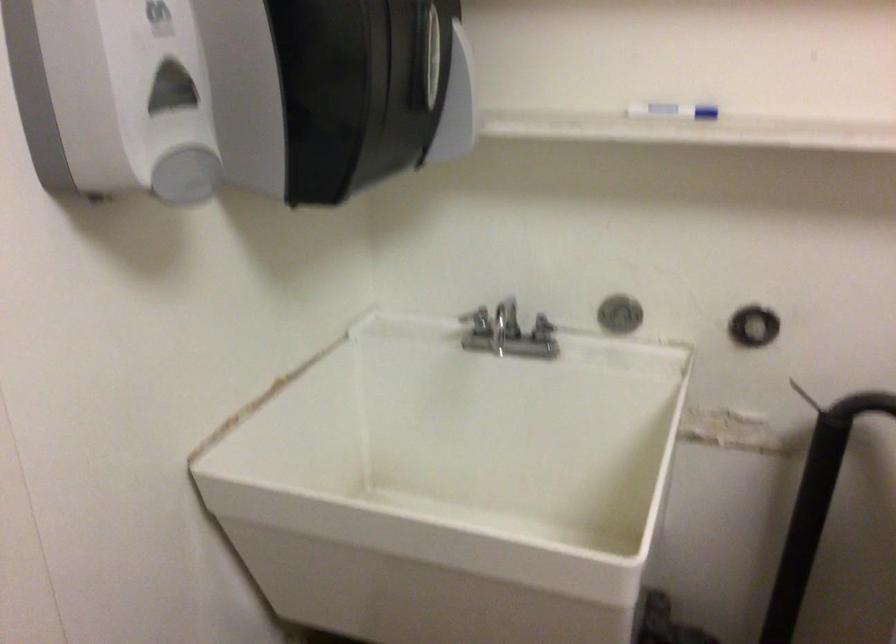
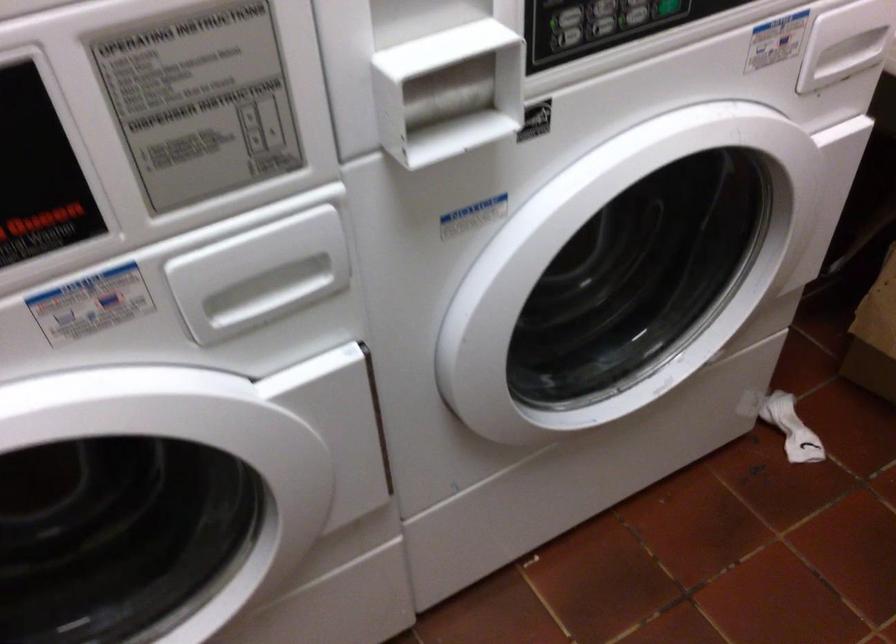
First-person continuous shooting, in which direction is the camera rotating?

The camera's rotation is toward right-down.